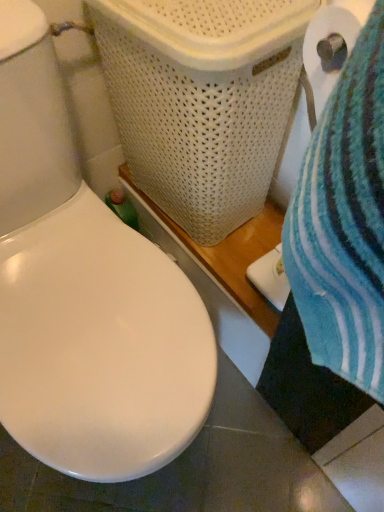
Question: Visually, is white woven laundry basket at upper center positioned to the left or to the right of white paper at right?

Choices:
 (A) left
 (B) right

Answer: (A)

Question: In terms of height, does white woven laundry basket at upper center look taller or shorter compared to white paper at right?

Choices:
 (A) short
 (B) tall

Answer: (B)

Question: Considering their positions, is white woven laundry basket at upper center located in front of or behind white paper at right?

Choices:
 (A) front
 (B) behind

Answer: (B)

Question: Considering the positions of white paper at right and white woven laundry basket at upper center in the image, is white paper at right taller or shorter than white woven laundry basket at upper center?

Choices:
 (A) short
 (B) tall

Answer: (A)

Question: Is point (359, 18) closer or farther from the camera than point (117, 17)?

Choices:
 (A) closer
 (B) farther

Answer: (A)

Question: In terms of size, does white paper at right appear bigger or smaller than white woven laundry basket at upper center?

Choices:
 (A) small
 (B) big

Answer: (A)

Question: In terms of width, does white paper at right look wider or thinner when compared to white woven laundry basket at upper center?

Choices:
 (A) wide
 (B) thin

Answer: (B)